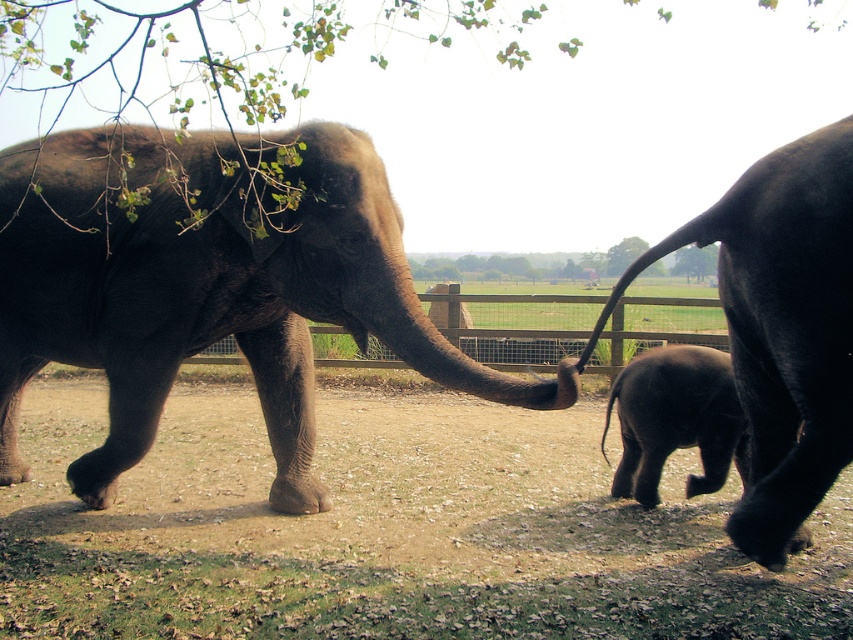
You are a zookeeper observing the elephants. You notice the dark brown wrinkled skin baby elephant at center and the brown sandy dirt at center. Which object is positioned to the right of the other?

The brown sandy dirt at center is to the left of dark brown wrinkled skin baby elephant at center, so the dark brown wrinkled skin baby elephant at center is positioned to the right of the brown sandy dirt at center.

You are a zookeeper observing the elephants. You notice the dark brown wrinkled skin baby elephant at center and the brown sandy dirt at center. Which object is closer to the camera?

The brown sandy dirt at center is in front of the dark brown wrinkled skin baby elephant at center, so the brown sandy dirt at center is closer to the camera.

You are standing at the point labeled as point (90,243) and want to walk to the exit gate located at point (343,563). However, there is a fence blocking your path. Can you determine if you can see the exit gate from your current position?

Point (343,563) is in front of point (90,243), so yes, you can see the exit gate at point (343,563) from your current position at point (90,243) because it is in front of you and not obstructed by the fence.